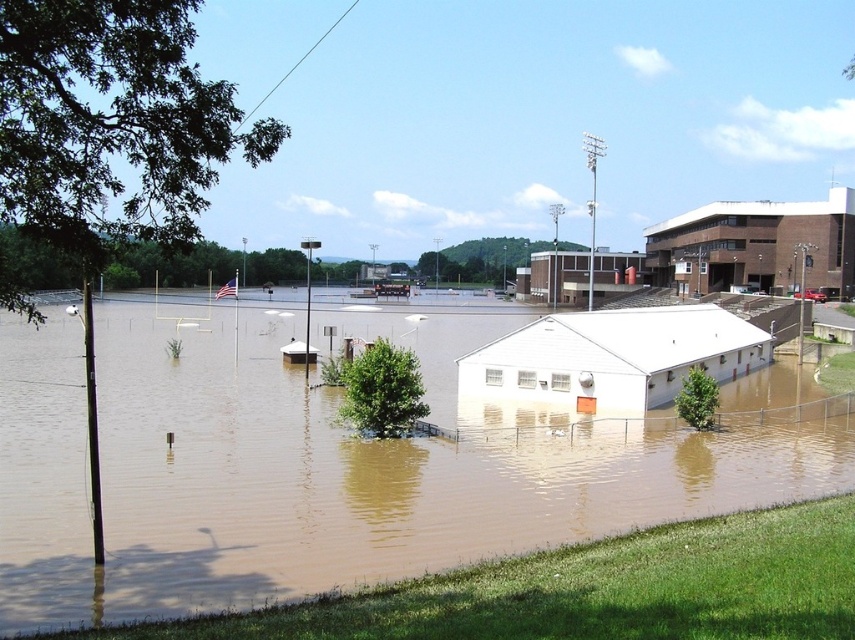
At what (x,y) coordinates should I click in order to perform the action: click on brown muddy flood at center. Please return your answer as a coordinate pair (x, y). The height and width of the screenshot is (640, 855). Looking at the image, I should click on [x=329, y=467].

The image size is (855, 640). I want to click on brown muddy flood at center, so click(329, 467).